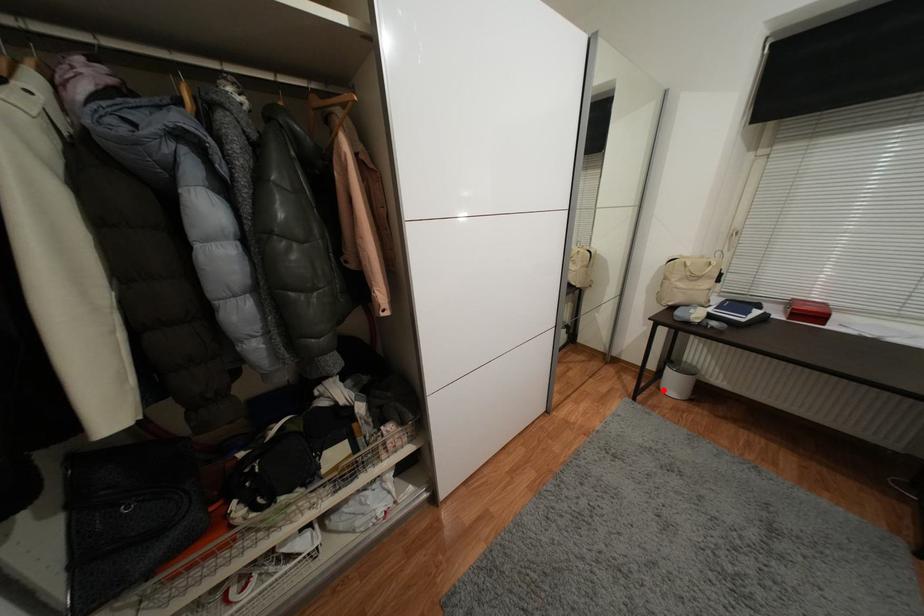
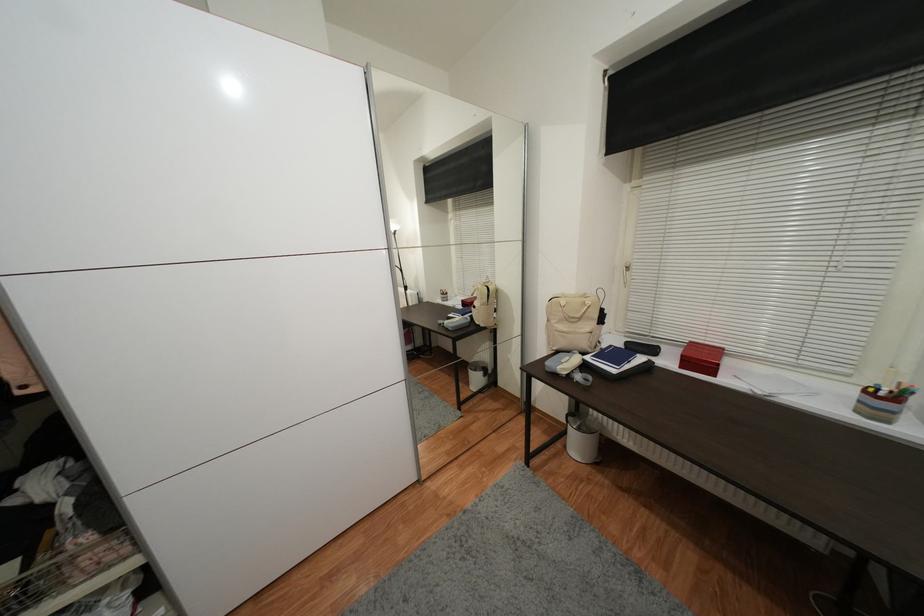
Question: I am providing you with two images of the same scene from different viewpoints. In image1, a red point is highlighted. Considering the same 3D point in image2, which of the following is correct?

Choices:
 (A) It is closer
 (B) It is farther

Answer: (A)